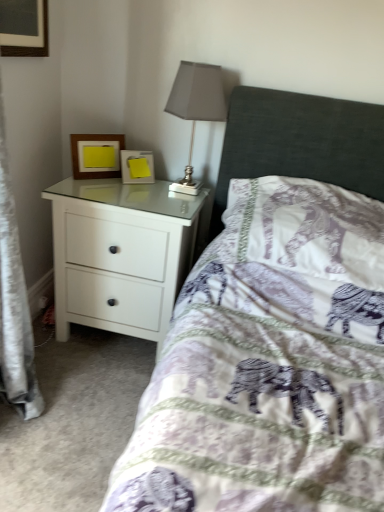
Question: From the image's perspective, is wooden picture frame at upper left, the second picture frame in the right-to-left sequence, under matte gray lampshade at upper center?

Choices:
 (A) no
 (B) yes

Answer: (B)

Question: Can you confirm if wooden picture frame at upper left, the second picture frame in the right-to-left sequence, is bigger than matte gray lampshade at upper center?

Choices:
 (A) yes
 (B) no

Answer: (B)

Question: Is wooden picture frame at upper left, placed as the first picture frame when sorted from left to right, shorter than matte gray lampshade at upper center?

Choices:
 (A) no
 (B) yes

Answer: (B)

Question: Can you confirm if wooden picture frame at upper left, the second picture frame in the right-to-left sequence, is taller than matte gray lampshade at upper center?

Choices:
 (A) no
 (B) yes

Answer: (A)

Question: Is matte gray lampshade at upper center completely or partially inside wooden picture frame at upper left, placed as the first picture frame when sorted from left to right?

Choices:
 (A) yes
 (B) no

Answer: (B)

Question: Considering the relative sizes of wooden picture frame at upper left, placed as the first picture frame when sorted from left to right, and matte gray lampshade at upper center in the image provided, is wooden picture frame at upper left, placed as the first picture frame when sorted from left to right, wider than matte gray lampshade at upper center?

Choices:
 (A) yes
 (B) no

Answer: (B)

Question: Would you say wooden picture frame at upper left, placed as the first picture frame when sorted from left to right, contains purple elephant-patterned pillow at center?

Choices:
 (A) no
 (B) yes

Answer: (A)

Question: Can we say wooden picture frame at upper left, placed as the first picture frame when sorted from left to right, lies outside purple elephant-patterned pillow at center?

Choices:
 (A) yes
 (B) no

Answer: (A)

Question: Is wooden picture frame at upper left, placed as the first picture frame when sorted from left to right, facing away from purple elephant-patterned pillow at center?

Choices:
 (A) yes
 (B) no

Answer: (B)

Question: From the image's perspective, is wooden picture frame at upper left, the second picture frame in the right-to-left sequence, on top of purple elephant-patterned pillow at center?

Choices:
 (A) yes
 (B) no

Answer: (A)

Question: Is wooden picture frame at upper left, placed as the first picture frame when sorted from left to right, positioned behind purple elephant-patterned pillow at center?

Choices:
 (A) no
 (B) yes

Answer: (B)

Question: Considering the relative sizes of wooden picture frame at upper left, placed as the first picture frame when sorted from left to right, and purple elephant-patterned pillow at center in the image provided, is wooden picture frame at upper left, placed as the first picture frame when sorted from left to right, smaller than purple elephant-patterned pillow at center?

Choices:
 (A) no
 (B) yes

Answer: (B)

Question: Could you tell me if matte gray lampshade at upper center is turned towards purple elephant-patterned pillow at center?

Choices:
 (A) no
 (B) yes

Answer: (A)